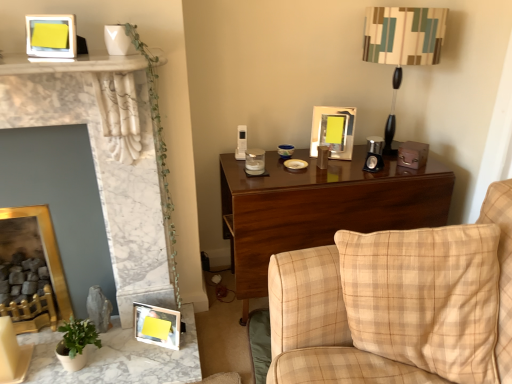
Question: From the image's perspective, is metallic silver picture frame at upper center, the first picture frame viewed from the right, above white marble fireplace at left?

Choices:
 (A) yes
 (B) no

Answer: (A)

Question: Is white marble fireplace at left surrounded by metallic silver picture frame at upper center, the first picture frame viewed from the right?

Choices:
 (A) yes
 (B) no

Answer: (B)

Question: Considering the relative sizes of metallic silver picture frame at upper center, the 2th picture frame positioned from the top, and white marble fireplace at left in the image provided, is metallic silver picture frame at upper center, the 2th picture frame positioned from the top, wider than white marble fireplace at left?

Choices:
 (A) yes
 (B) no

Answer: (B)

Question: Is metallic silver picture frame at upper center, the 2th picture frame positioned from the top, smaller than white marble fireplace at left?

Choices:
 (A) no
 (B) yes

Answer: (B)

Question: Considering the relative positions of metallic silver picture frame at upper center, the first picture frame viewed from the right, and white marble fireplace at left in the image provided, is metallic silver picture frame at upper center, the first picture frame viewed from the right, in front of white marble fireplace at left?

Choices:
 (A) no
 (B) yes

Answer: (A)

Question: From the image's perspective, relative to marble table at lower left, is metallic silver picture frame at upper center, positioned as the 4th picture frame in left-to-right order, above or below?

Choices:
 (A) below
 (B) above

Answer: (B)

Question: Visually, is metallic silver picture frame at upper center, the 2th picture frame positioned from the top, positioned to the left or to the right of marble table at lower left?

Choices:
 (A) right
 (B) left

Answer: (A)

Question: Relative to marble table at lower left, is metallic silver picture frame at upper center, the 2th picture frame positioned from the top, in front or behind?

Choices:
 (A) behind
 (B) front

Answer: (A)

Question: From a real-world perspective, is metallic silver picture frame at upper center, the first picture frame viewed from the right, positioned above or below marble table at lower left?

Choices:
 (A) above
 (B) below

Answer: (A)

Question: Looking at their shapes, would you say wooden photo frame at lower left, the fourth picture frame positioned from the top, is wider or thinner than white marble fireplace at left?

Choices:
 (A) thin
 (B) wide

Answer: (A)

Question: Is wooden photo frame at lower left, which is the 3th picture frame from left to right, taller or shorter than white marble fireplace at left?

Choices:
 (A) short
 (B) tall

Answer: (A)

Question: From the image's perspective, relative to white marble fireplace at left, is wooden photo frame at lower left, the fourth picture frame positioned from the top, above or below?

Choices:
 (A) above
 (B) below

Answer: (B)

Question: Is wooden photo frame at lower left, the fourth picture frame positioned from the top, bigger or smaller than white marble fireplace at left?

Choices:
 (A) big
 (B) small

Answer: (B)

Question: From a real-world perspective, is yellow matte picture frame at upper left, which ranks as the 4th picture frame in bottom-to-top order, above or below white marble fireplace at left?

Choices:
 (A) above
 (B) below

Answer: (A)

Question: From their relative heights in the image, would you say yellow matte picture frame at upper left, which is the second picture frame in left-to-right order, is taller or shorter than white marble fireplace at left?

Choices:
 (A) tall
 (B) short

Answer: (B)